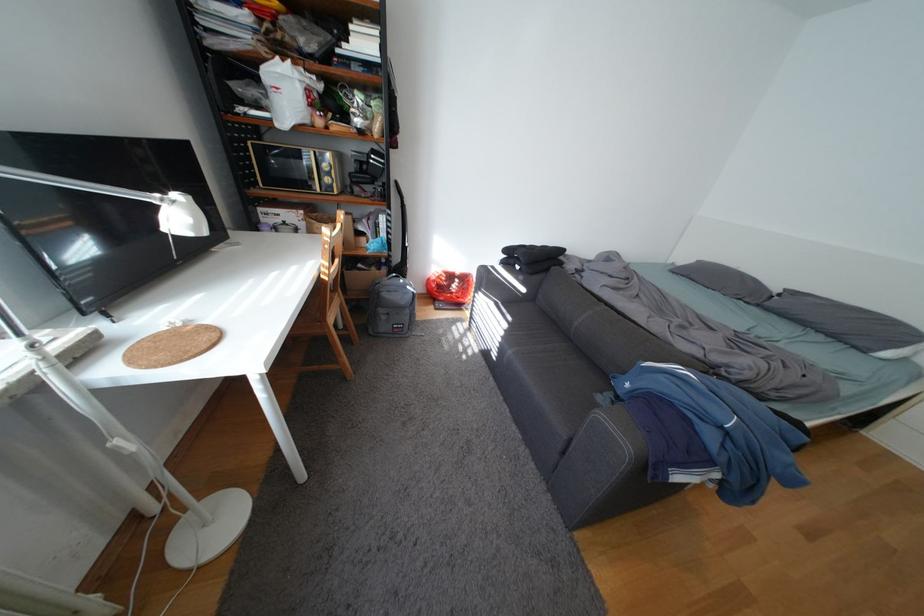
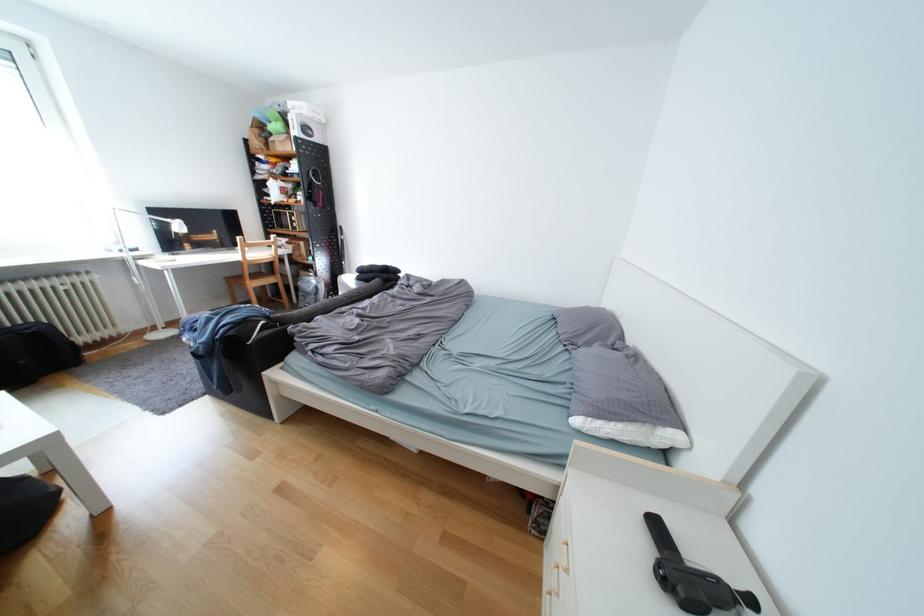
Where in the second image is the point corresponding to (393,310) from the first image?

(313, 294)